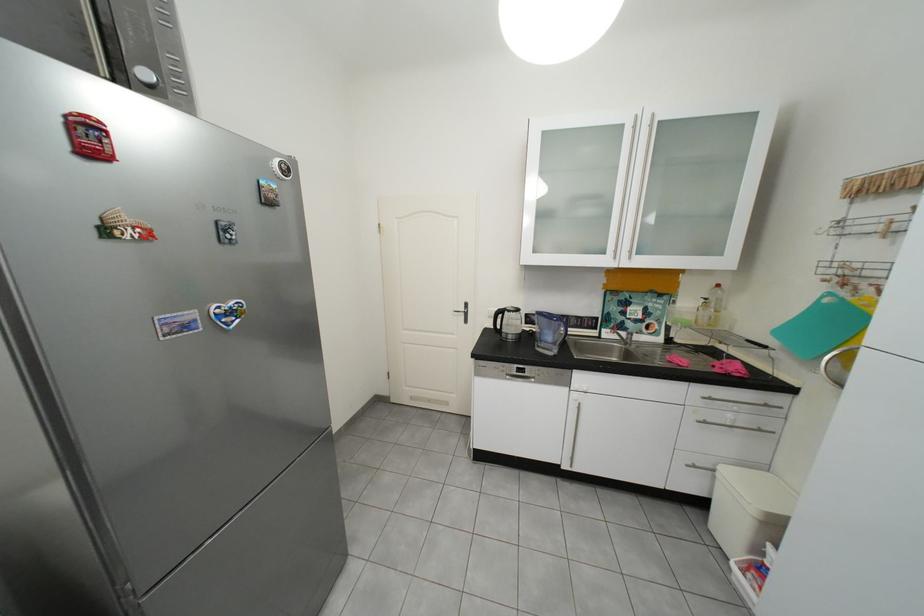
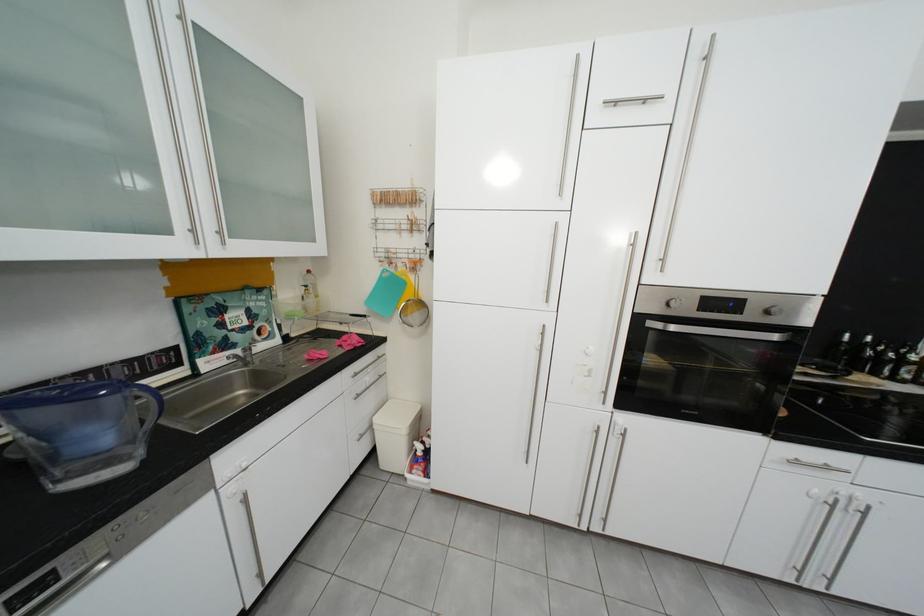
Where in the second image is the point corresponding to point (551, 347) from the first image?

(70, 483)